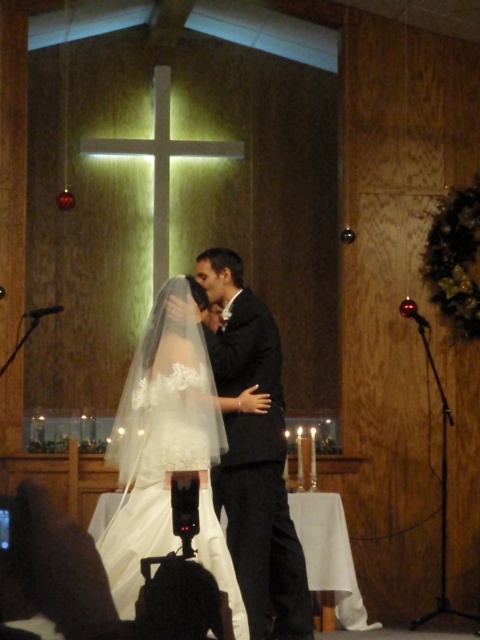
Which is behind, point (217, 444) or point (232, 506)?

The point (232, 506) is more distant.

Is white lace veil at center wider than black satin suit at center?

Indeed, white lace veil at center has a greater width compared to black satin suit at center.

The height and width of the screenshot is (640, 480). Find the location of `white lace veil at center`. white lace veil at center is located at coordinates (169, 448).